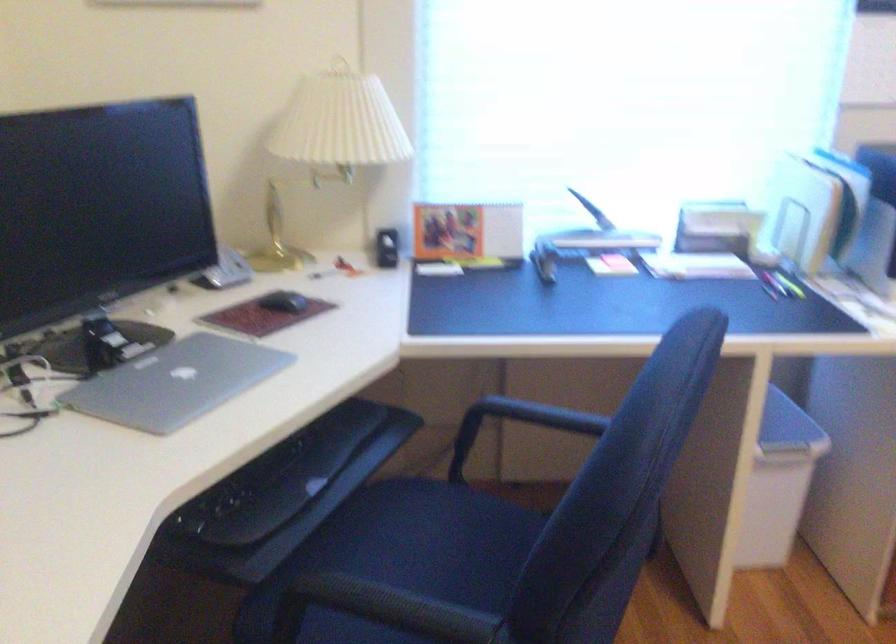
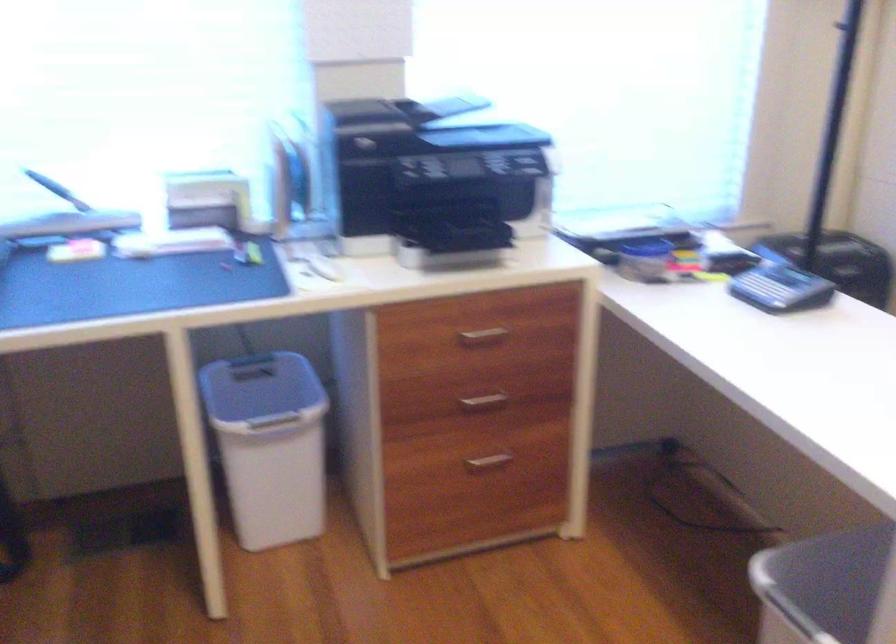
Question: The first image is from the beginning of the video and the second image is from the end. How did the camera likely rotate when shooting the video?

Choices:
 (A) Left
 (B) Right
 (C) Up
 (D) Down

Answer: (B)